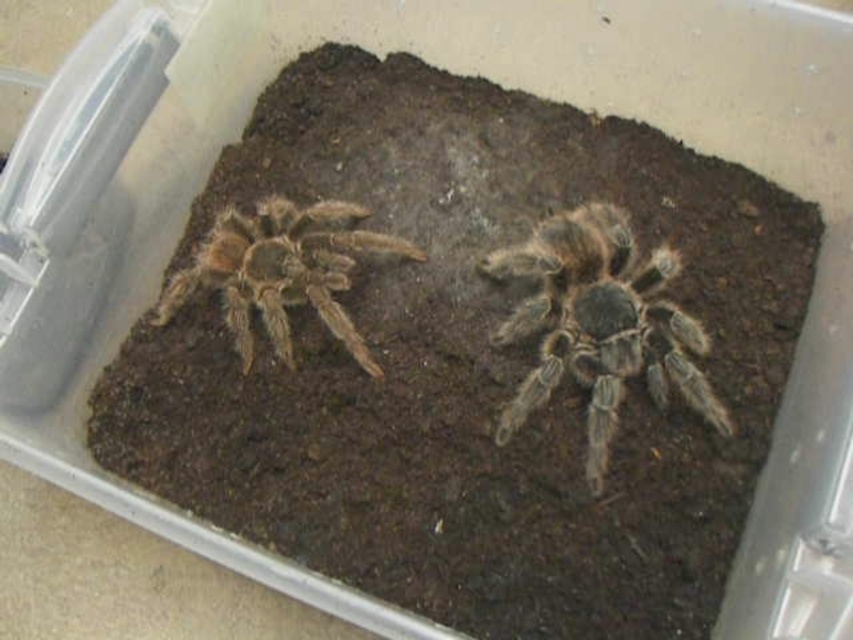
Question: Does fuzzy brown spider at center appear on the left side of brown fuzzy spider at left?

Choices:
 (A) yes
 (B) no

Answer: (B)

Question: Is the position of fuzzy brown spider at center more distant than that of brown fuzzy spider at left?

Choices:
 (A) yes
 (B) no

Answer: (B)

Question: Which point appears closest to the camera in this image?

Choices:
 (A) (595, 317)
 (B) (409, 257)

Answer: (A)

Question: Which object is closer to the camera taking this photo?

Choices:
 (A) fuzzy brown spider at center
 (B) brown fuzzy spider at left

Answer: (A)

Question: From the image, what is the correct spatial relationship of fuzzy brown spider at center in relation to brown fuzzy spider at left?

Choices:
 (A) below
 (B) above

Answer: (A)